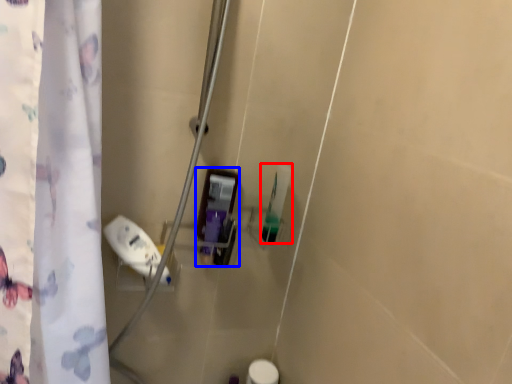
Question: Which of the following is the farthest to the observer, toiletry (highlighted by a red box) or toiletry (highlighted by a blue box)?

Choices:
 (A) toiletry
 (B) toiletry

Answer: (A)